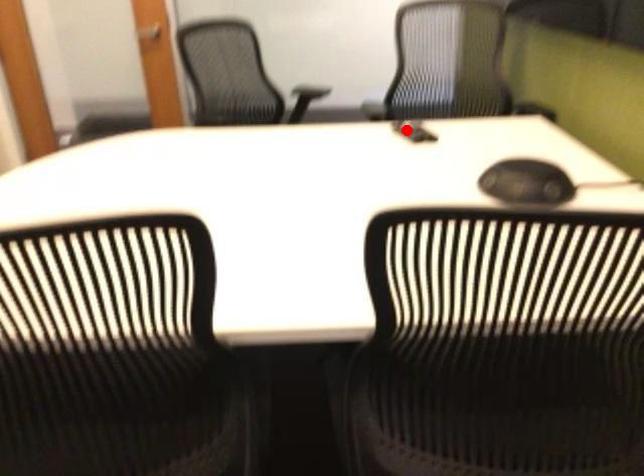
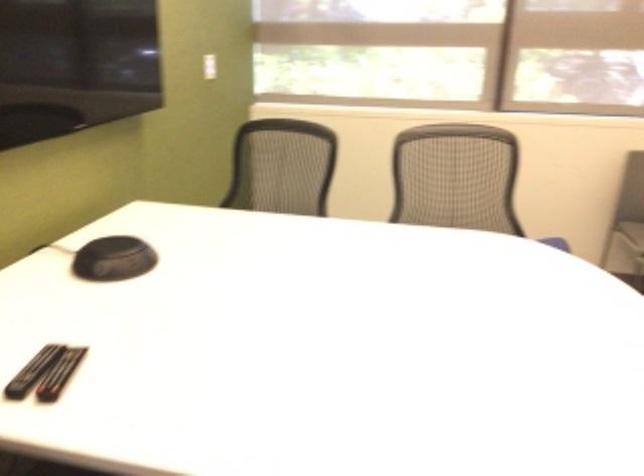
Question: I am providing you with two images of the same scene from different viewpoints. A red point is marked on the first image. At the location where the point appears in image 1, is it still visible in image 2?

Choices:
 (A) Yes
 (B) No

Answer: (A)